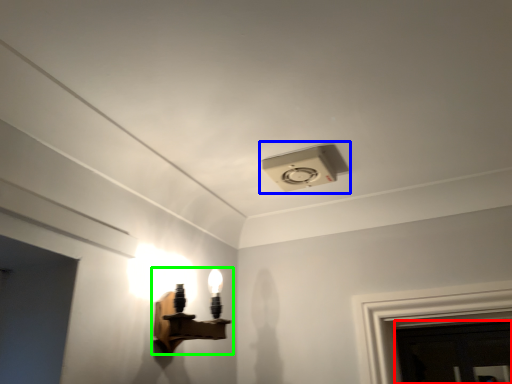
Question: Which object is the closest to the door (highlighted by a red box)? Choose among these: lamp (highlighted by a blue box) or lamp (highlighted by a green box).

Choices:
 (A) lamp
 (B) lamp

Answer: (B)